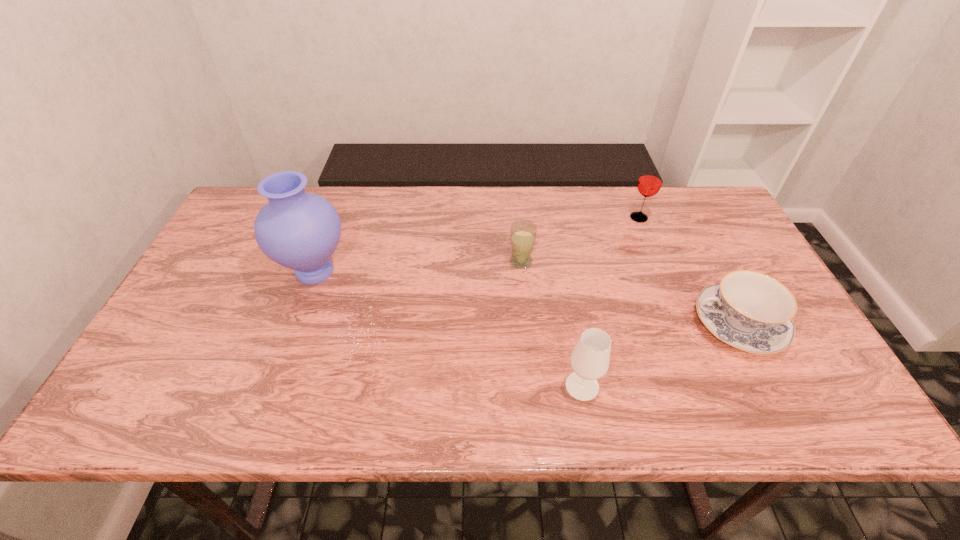
The image size is (960, 540). In order to click on vacant space located 0.090m on the back of the rightmost glass in this screenshot , I will do `click(630, 194)`.

This screenshot has height=540, width=960. Identify the location of vacant space positioned on the left of the second glass from left to right. (417, 386).

The width and height of the screenshot is (960, 540). In order to click on vacant space located on the front of the second farthest glass in this screenshot , I will do `click(523, 289)`.

Where is `vacant position located 0.150m with the handle on the side of the chinaware`? vacant position located 0.150m with the handle on the side of the chinaware is located at coordinates (630, 324).

Find the location of a particular element. free location located with the handle on the side of the chinaware is located at coordinates (556, 324).

Locate an element on the screen. free space located with the handle on the side of the chinaware is located at coordinates (634, 324).

You are a GUI agent. You are given a task and a screenshot of the screen. Output one action in this format:
    pyautogui.click(x=<x>, y=<y>)
    Task: Click on the object that is at the far edge
    The image size is (960, 540).
    Given the screenshot: What is the action you would take?
    pyautogui.click(x=650, y=181)

Identify the location of object that is positioned at the near edge. (590, 358).

Image resolution: width=960 pixels, height=540 pixels. I want to click on object at the right edge, so click(748, 310).

At what (x,y) coordinates should I click in order to perform the action: click on vacant space at the far edge. Please return your answer as a coordinate pair (x, y). The height and width of the screenshot is (540, 960). Looking at the image, I should click on (573, 229).